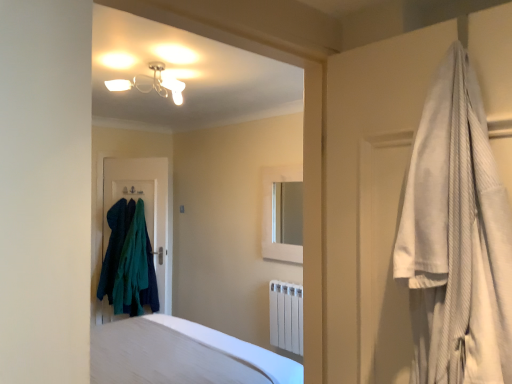
What do you see at coordinates (145, 210) in the screenshot?
I see `dark teal fabric door at center` at bounding box center [145, 210].

Describe the element at coordinates (456, 238) in the screenshot. The height and width of the screenshot is (384, 512). I see `white textured robe at right` at that location.

What is the approximate width of white matte medicine cabinet at center?

white matte medicine cabinet at center is 9.59 centimeters wide.

The width and height of the screenshot is (512, 384). Describe the element at coordinates (271, 214) in the screenshot. I see `white matte medicine cabinet at center` at that location.

Locate an element on the screen. The height and width of the screenshot is (384, 512). white smooth bed at lower center is located at coordinates (182, 355).

You are a GUI agent. You are given a task and a screenshot of the screen. Output one action in this format:
    pyautogui.click(x=<x>, y=<y>)
    Task: Click on the dark teal fabric door at center
    This screenshot has width=512, height=384.
    Given the screenshot: What is the action you would take?
    pyautogui.click(x=145, y=210)

The image size is (512, 384). Find the location of `bed in front of the dark teal fabric door at center`. bed in front of the dark teal fabric door at center is located at coordinates (182, 355).

Is white smooth bed at lower center in front of or behind dark teal fabric door at center in the image?

white smooth bed at lower center is in front of dark teal fabric door at center.

Does white smooth bed at lower center have a lesser height compared to dark teal fabric door at center?

Yes.

Between white matte medicine cabinet at center and teal fabric towels at left, which one has larger size?

Bigger between the two is teal fabric towels at left.

Could you tell me if white matte medicine cabinet at center is facing teal fabric towels at left?

No, white matte medicine cabinet at center does not turn towards teal fabric towels at left.

Would you say white matte medicine cabinet at center is outside teal fabric towels at left?

white matte medicine cabinet at center is positioned outside teal fabric towels at left.

From a real-world perspective, is white matte medicine cabinet at center above or below teal fabric towels at left?

white matte medicine cabinet at center is situated higher than teal fabric towels at left in the real world.

Could teal fabric towels at left be considered to be inside white textured robe at right?

Actually, teal fabric towels at left is outside white textured robe at right.

Does white textured robe at right appear on the right side of teal fabric towels at left?

Indeed, white textured robe at right is positioned on the right side of teal fabric towels at left.

From a real-world perspective, which object stands above the other?

white textured robe at right.

From a real-world perspective, is teal fabric towels at left physically located above or below white matte radiator at lower center?

Clearly, from a real-world perspective, teal fabric towels at left is above white matte radiator at lower center.

Is teal fabric towels at left looking in the opposite direction of white matte radiator at lower center?

teal fabric towels at left is not turned away from white matte radiator at lower center.

What are the coordinates of `clothing that appears on the left of white matte radiator at lower center` in the screenshot? It's located at (115, 245).

From the image's perspective, is white textured robe at right on dark teal fabric door at center?

Yes, from the image's perspective, white textured robe at right is on top of dark teal fabric door at center.

From a real-world perspective, is white textured robe at right beneath dark teal fabric door at center?

No, from a real-world perspective, white textured robe at right is not under dark teal fabric door at center.

Is white textured robe at right to the left or to the right of dark teal fabric door at center in the image?

white textured robe at right is to the right of dark teal fabric door at center.

Would you say white matte medicine cabinet at center is outside dark teal fabric door at center?

Yes.

Consider the image. From a real-world perspective, is white matte medicine cabinet at center positioned over dark teal fabric door at center based on gravity?

Correct, in the physical world, white matte medicine cabinet at center is higher than dark teal fabric door at center.

Are white matte medicine cabinet at center and dark teal fabric door at center beside each other?

There is a gap between white matte medicine cabinet at center and dark teal fabric door at center.

Which object is closer to the camera taking this photo, white matte radiator at lower center or teal fabric towels at left?

white matte radiator at lower center is in front.

Who is shorter, white matte radiator at lower center or teal fabric towels at left?

white matte radiator at lower center.

Is white matte radiator at lower center situated inside teal fabric towels at left or outside?

white matte radiator at lower center is spatially situated outside teal fabric towels at left.

Considering the relative sizes of white matte radiator at lower center and teal fabric towels at left in the image provided, is white matte radiator at lower center bigger than teal fabric towels at left?

No, white matte radiator at lower center is not bigger than teal fabric towels at left.

Where is `bed to the right of dark teal fabric door at center`? The height and width of the screenshot is (384, 512). bed to the right of dark teal fabric door at center is located at coordinates (182, 355).

Where is `clothing located underneath the white matte medicine cabinet at center (from a real-world perspective)`? clothing located underneath the white matte medicine cabinet at center (from a real-world perspective) is located at coordinates (115, 245).

Based on their spatial positions, is white smooth bed at lower center or white matte medicine cabinet at center closer to white matte radiator at lower center?

white matte medicine cabinet at center is positioned closer to the anchor white matte radiator at lower center.

Looking at the image, which one is located further to white matte radiator at lower center, dark teal fabric door at center or teal fabric towels at left?

teal fabric towels at left.

Based on their spatial positions, is white matte medicine cabinet at center or white smooth bed at lower center further from dark teal fabric door at center?

white smooth bed at lower center is further to dark teal fabric door at center.

Considering their positions, is dark teal fabric door at center positioned further to teal fabric towels at left than white textured robe at right?

Based on the image, white textured robe at right appears to be further to teal fabric towels at left.

When comparing their distances from teal fabric towels at left, does white smooth bed at lower center or white matte radiator at lower center seem closer?

Among the two, white matte radiator at lower center is located nearer to teal fabric towels at left.

From the image, which object appears to be farther from white matte radiator at lower center, dark teal fabric door at center or white smooth bed at lower center?

dark teal fabric door at center lies further to white matte radiator at lower center than the other object.

When comparing their distances from white matte medicine cabinet at center, does teal fabric towels at left or white textured robe at right seem closer?

teal fabric towels at left.

Considering their positions, is white matte medicine cabinet at center positioned closer to white smooth bed at lower center than white textured robe at right?

The object closer to white smooth bed at lower center is white matte medicine cabinet at center.

The image size is (512, 384). Identify the location of medicine cabinet between dark teal fabric door at center and white matte radiator at lower center from left to right. (271, 214).

Find the location of a particular element. medicine cabinet between white textured robe at right and dark teal fabric door at center from front to back is located at coordinates (271, 214).

Image resolution: width=512 pixels, height=384 pixels. Identify the location of bed between white textured robe at right and teal fabric towels at left along the z-axis. (182, 355).

Find the location of a particular element. This screenshot has height=384, width=512. clothing between white textured robe at right and dark teal fabric door at center in the front-back direction is located at coordinates (115, 245).